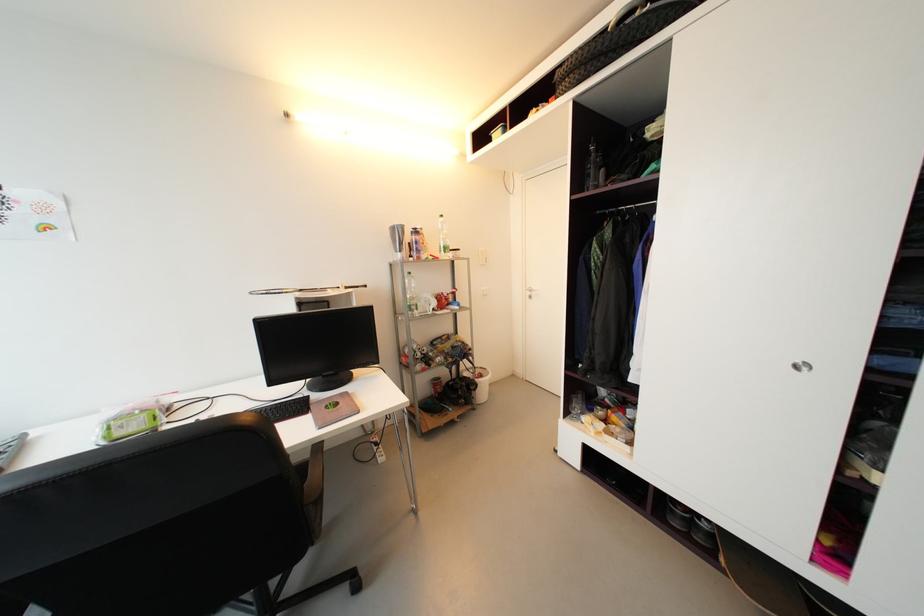
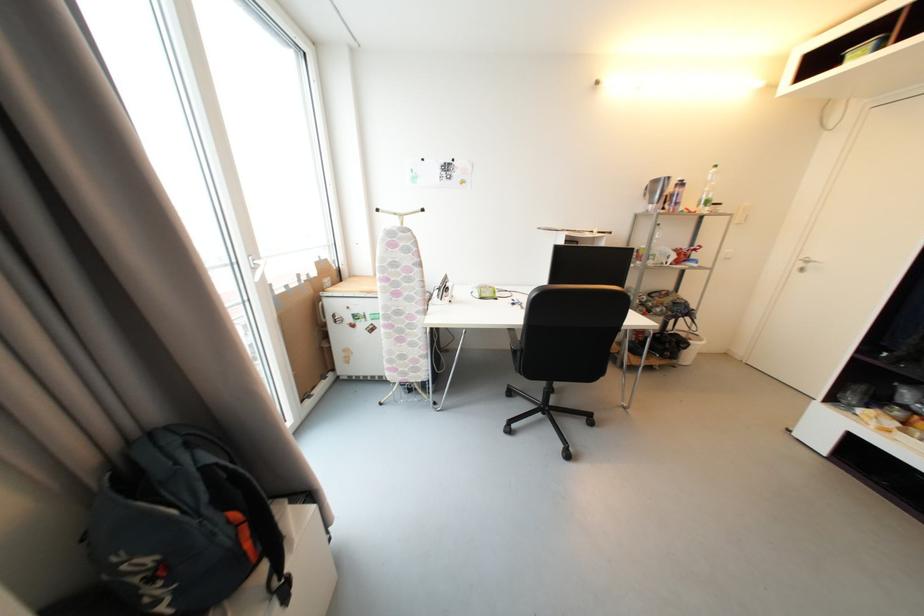
In the second image, find the point that corresponds to (533,294) in the first image.

(806, 267)